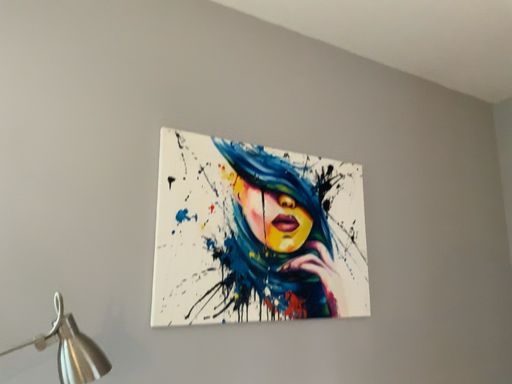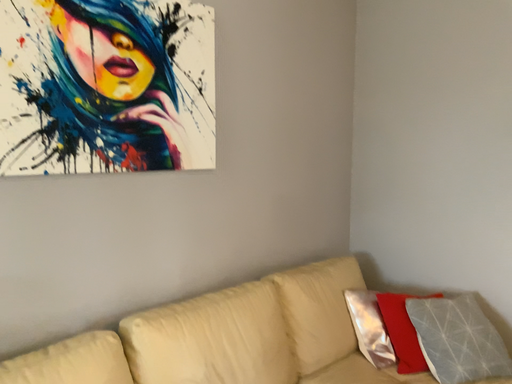
Question: How did the camera likely rotate when shooting the video?

Choices:
 (A) rotated left
 (B) rotated right

Answer: (B)